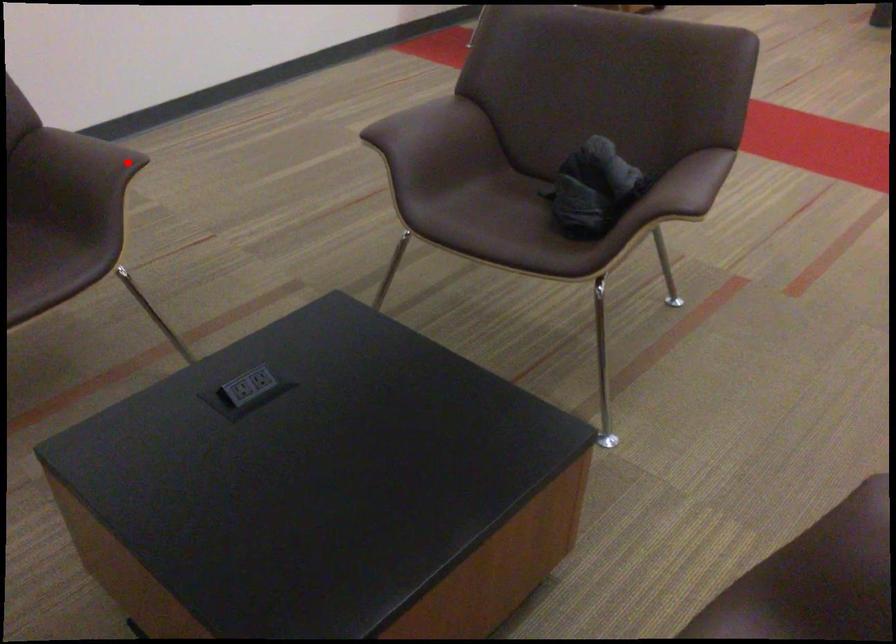
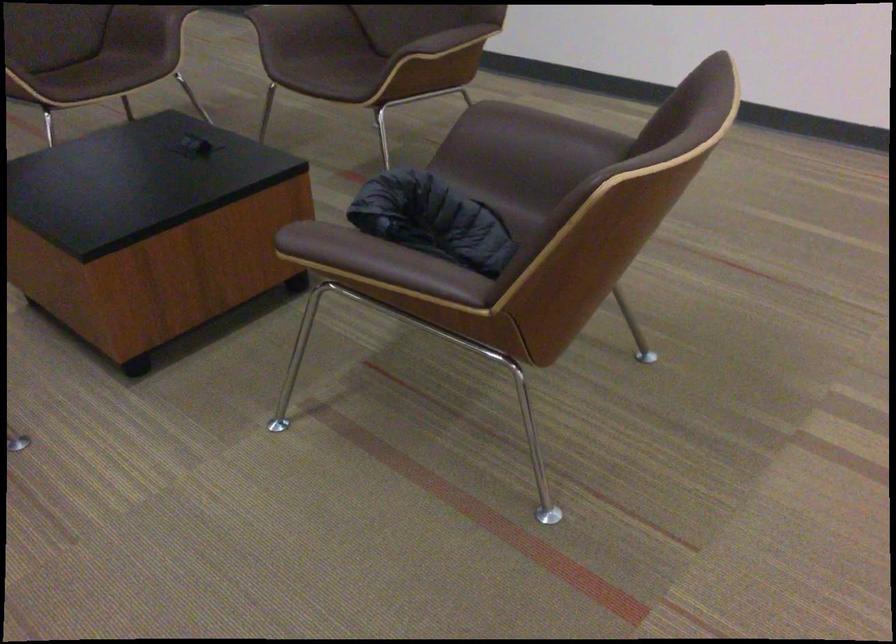
Locate, in the second image, the point that corresponds to the highlighted location in the first image.

(444, 46)